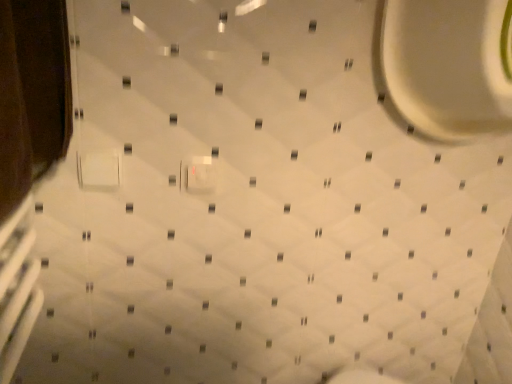
Question: Should I look upward or downward to see white glossy toilet at upper right?

Choices:
 (A) up
 (B) down

Answer: (A)